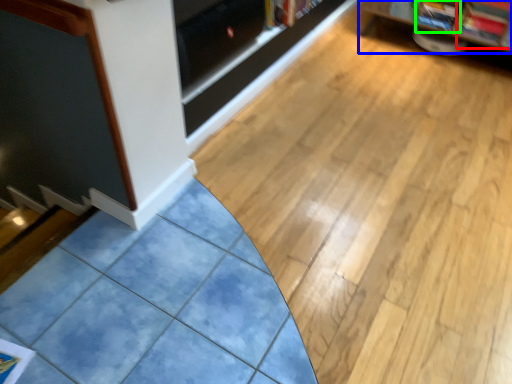
Question: Considering the real-world distances, which object is closest to magazine (highlighted by a red box)? shelf (highlighted by a blue box) or magazine (highlighted by a green box).

Choices:
 (A) shelf
 (B) magazine

Answer: (B)